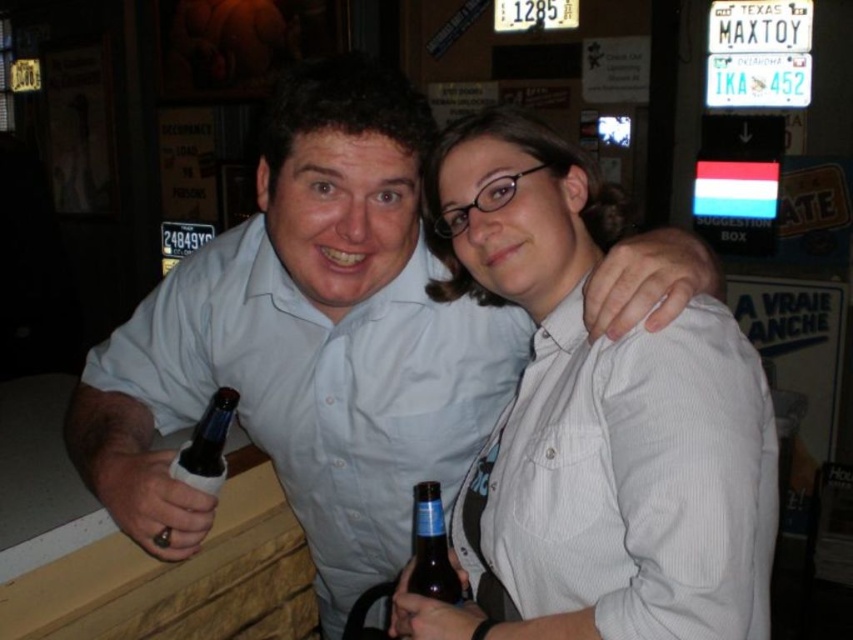
Question: Which is nearer to the matte light blue shirt at center?

Choices:
 (A) brown glass bottle at center
 (B) dark glass bottle at lower left
 (C) white textured shirt at center

Answer: (B)

Question: Which object is the farthest from the brown glass bottle at center?

Choices:
 (A) white textured shirt at center
 (B) matte light blue shirt at center
 (C) dark glass bottle at lower left

Answer: (B)

Question: Is the position of matte light blue shirt at center less distant than that of white textured shirt at center?

Choices:
 (A) no
 (B) yes

Answer: (A)

Question: Which of these objects is positioned closest to the dark glass bottle at lower left?

Choices:
 (A) matte light blue shirt at center
 (B) brown glass bottle at center
 (C) white textured shirt at center

Answer: (A)

Question: Does matte light blue shirt at center lie behind dark glass bottle at lower left?

Choices:
 (A) yes
 (B) no

Answer: (B)

Question: Is matte light blue shirt at center bigger than white textured shirt at center?

Choices:
 (A) yes
 (B) no

Answer: (A)